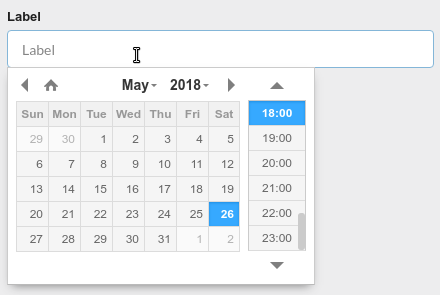
Locate an element on the screen. digital calendar is located at coordinates (149, 89), (201, 82), (132, 201), (193, 246).